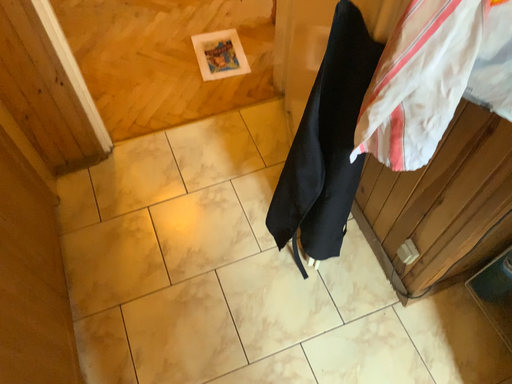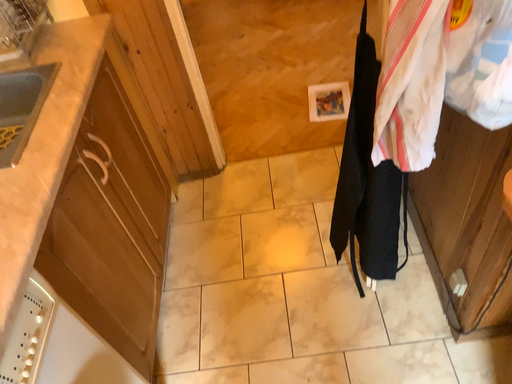
Question: Which way did the camera rotate in the video?

Choices:
 (A) rotated upward
 (B) rotated downward

Answer: (A)